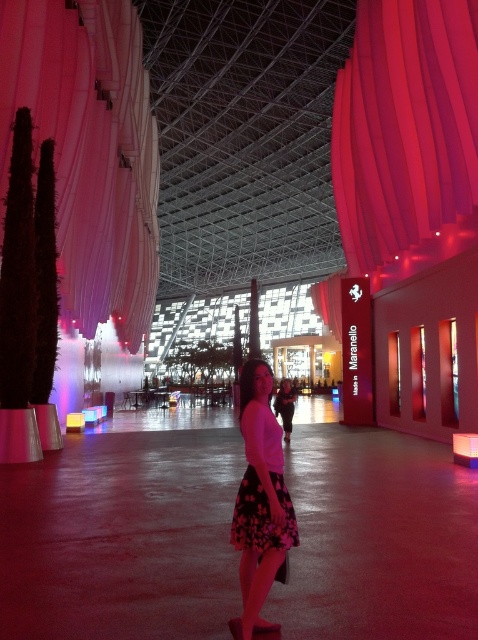
Question: Considering the relative positions of white matte skirt at center and floral cotton dress at center in the image provided, where is white matte skirt at center located with respect to floral cotton dress at center?

Choices:
 (A) left
 (B) right

Answer: (A)

Question: Which is nearer to the silky white curtain at left?

Choices:
 (A) floral cotton dress at center
 (B) white matte skirt at center

Answer: (B)

Question: Does white matte skirt at center have a lesser width compared to floral cotton dress at center?

Choices:
 (A) yes
 (B) no

Answer: (A)

Question: Which point is farther to the camera?

Choices:
 (A) matte pink curtain at upper right
 (B) floral cotton dress at center
 (C) silky white curtain at left
 (D) matte black dress at center

Answer: (D)

Question: Is silky white curtain at left above matte black dress at center?

Choices:
 (A) yes
 (B) no

Answer: (A)

Question: Among these objects, which one is nearest to the camera?

Choices:
 (A) white matte skirt at center
 (B) matte black dress at center
 (C) floral cotton dress at center
 (D) silky white curtain at left

Answer: (A)